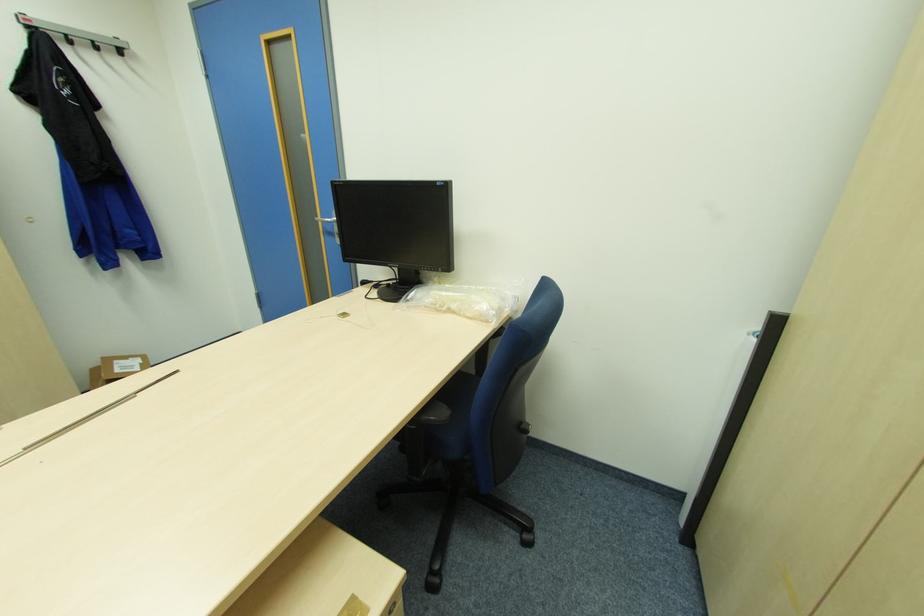
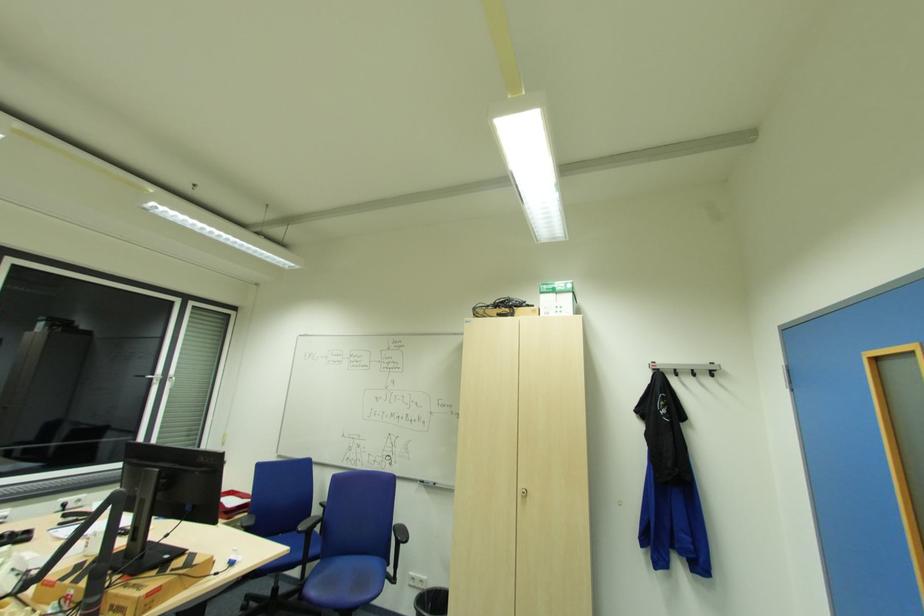
Based on the continuous images, in which direction is the camera rotating?

The rotation direction of the camera is left-up.